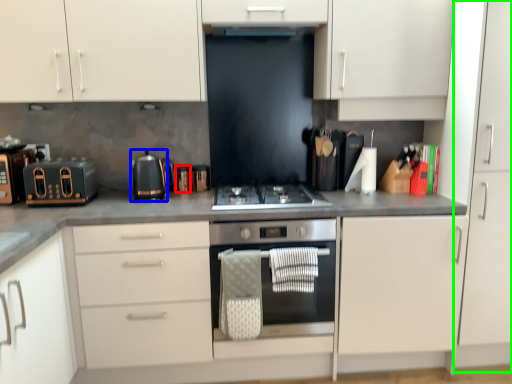
Question: Which object is the farthest from appliance (highlighted by a red box)? Choose among these: kitchen appliance (highlighted by a blue box) or cabinet (highlighted by a green box).

Choices:
 (A) kitchen appliance
 (B) cabinet

Answer: (B)